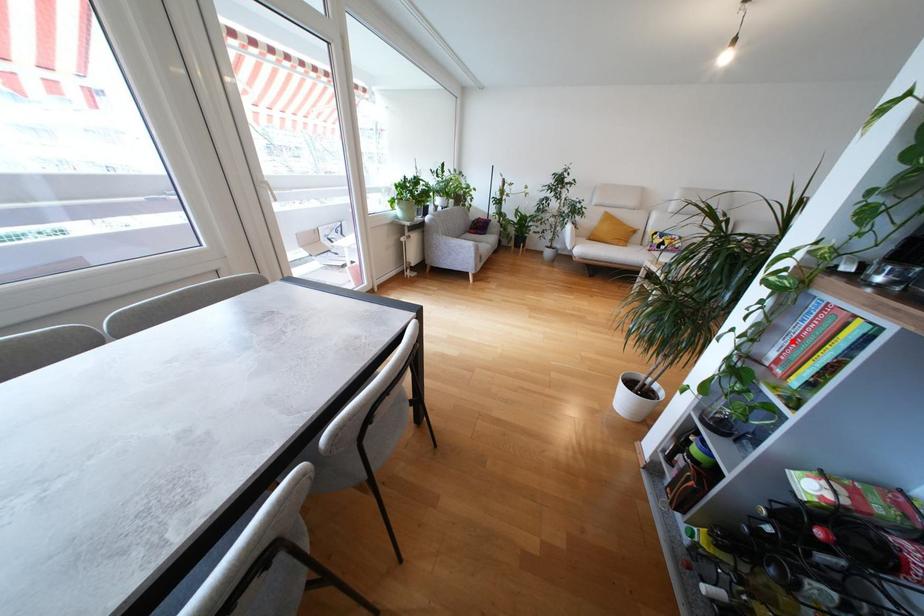
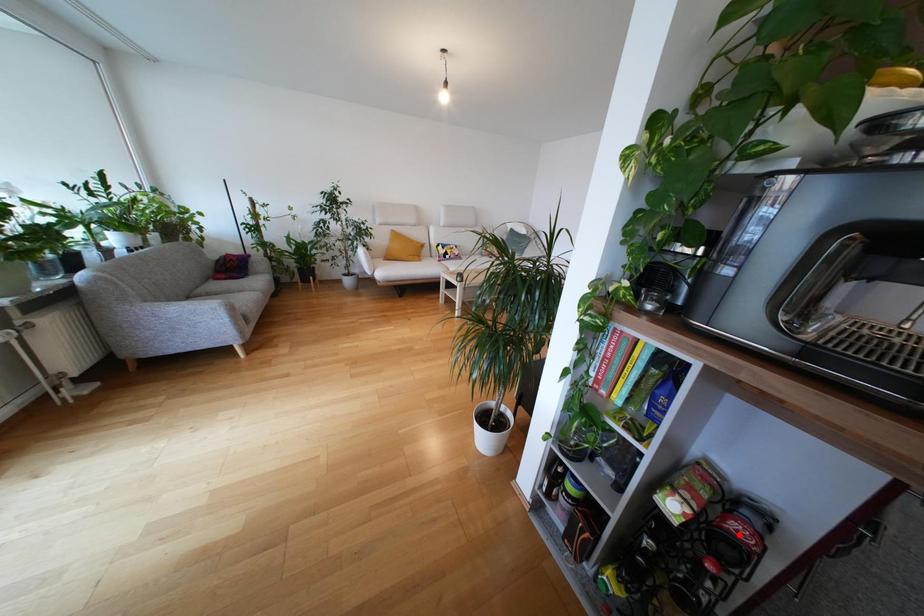
I am providing you with two images of the same scene from different viewpoints. A red point is marked on the first image and another point is marked on the second image. Is the marked point in image1 the same physical position as the marked point in image2?

No